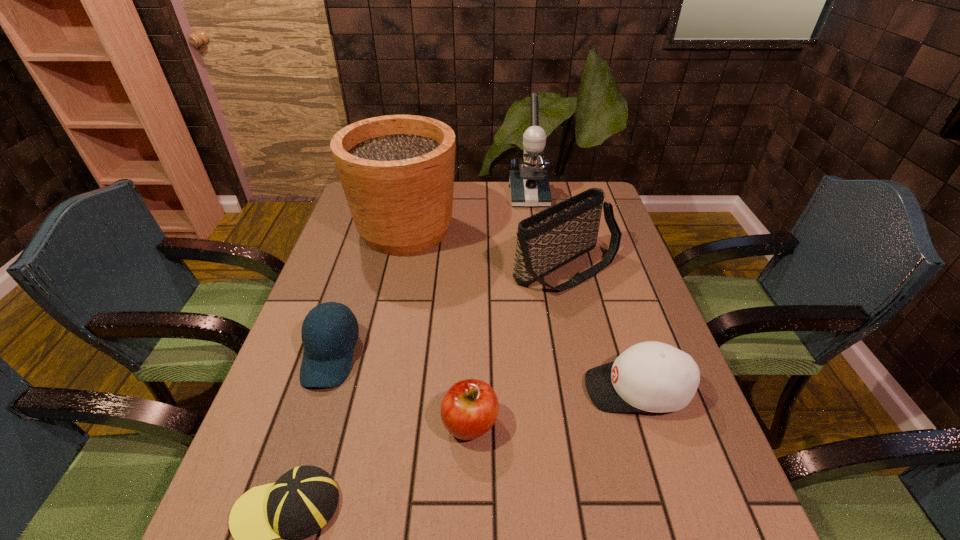
Image resolution: width=960 pixels, height=540 pixels. What are the coordinates of `microscope` in the screenshot? It's located at (529, 186).

At what (x,y) coordinates should I click in order to perform the action: click on flowerpot. Please return your answer as a coordinate pair (x, y). This screenshot has width=960, height=540. Looking at the image, I should click on (397, 171).

Image resolution: width=960 pixels, height=540 pixels. I want to click on the fifth shortest object, so click(546, 241).

Locate an element on the screen. The width and height of the screenshot is (960, 540). the rightmost baseball cap is located at coordinates (651, 376).

The image size is (960, 540). What are the coordinates of `apple` in the screenshot? It's located at point(470,407).

At what (x,y) coordinates should I click in order to perform the action: click on free space located 0.340m at the eyepiece of the microscope. Please return your answer as a coordinate pair (x, y). The height and width of the screenshot is (540, 960). Looking at the image, I should click on (540, 271).

This screenshot has height=540, width=960. Identify the location of free location located on the front of the flowerpot. (384, 328).

You are a GUI agent. You are given a task and a screenshot of the screen. Output one action in this format:
    pyautogui.click(x=<x>, y=<y>)
    Task: Click on the free space located on the left of the handbag
    The width and height of the screenshot is (960, 540).
    Given the screenshot: What is the action you would take?
    pyautogui.click(x=398, y=267)

Image resolution: width=960 pixels, height=540 pixels. What are the coordinates of `free space located 0.190m on the front-facing side of the rightmost baseball cap` in the screenshot? It's located at (498, 389).

Find the location of a particular element. free space located 0.120m on the front-facing side of the rightmost baseball cap is located at coordinates (530, 389).